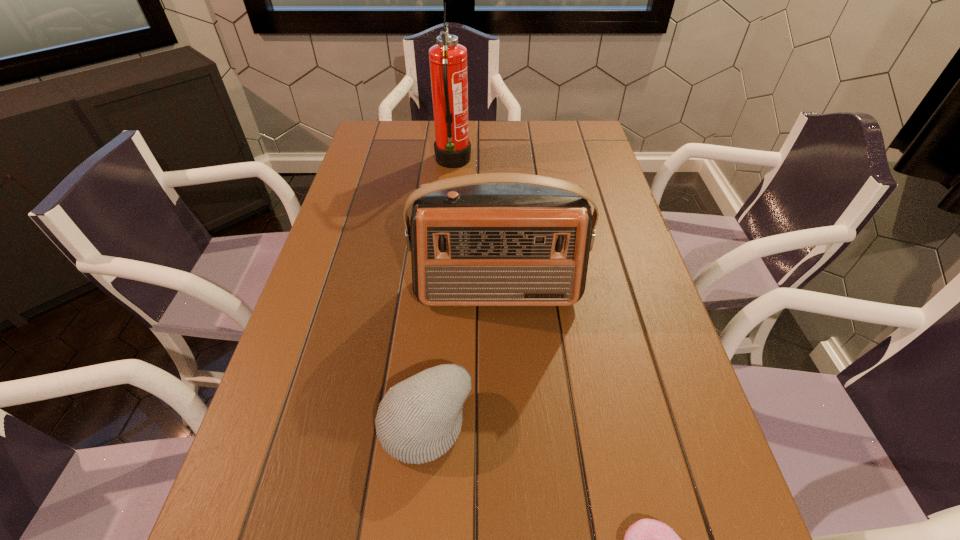
In the image, there is a desktop. Where is `free space at the far edge`? free space at the far edge is located at coordinates (416, 126).

Identify the location of vacant space at the left edge of the desktop. The image size is (960, 540). (336, 292).

In the image, there is a desktop. Identify the location of vacant space at the right edge. The width and height of the screenshot is (960, 540). (614, 242).

Locate an element on the screen. Image resolution: width=960 pixels, height=540 pixels. vacant space at the far left corner of the desktop is located at coordinates (395, 151).

Where is `vacant space at the far right corner of the desktop`? vacant space at the far right corner of the desktop is located at coordinates (596, 148).

Identify the location of unoccupied position between the beanie and the radio receiver. (462, 357).

Locate an element on the screen. The image size is (960, 540). empty space between the beanie and the third shortest object is located at coordinates (462, 357).

Locate which object is the closest to the nearest object. Please provide its 2D coordinates. Your answer should be formatted as a tuple, i.e. [(x, y)], where the tuple contains the x and y coordinates of a point satisfying the conditions above.

[(418, 420)]

Where is `the second closest object to the radio receiver`? the second closest object to the radio receiver is located at coordinates (448, 60).

This screenshot has width=960, height=540. Find the location of `free space that satisfies the following two spatial constraints: 1. on the front-facing side of the tallest object; 2. on the front side of the third tallest object`. free space that satisfies the following two spatial constraints: 1. on the front-facing side of the tallest object; 2. on the front side of the third tallest object is located at coordinates (432, 423).